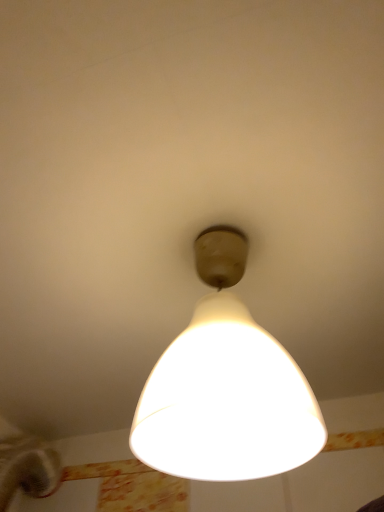
This screenshot has width=384, height=512. What are the coordinates of `matte white lampshade at center` in the screenshot? It's located at (225, 387).

What do you see at coordinates (225, 387) in the screenshot? Image resolution: width=384 pixels, height=512 pixels. I see `matte white lampshade at center` at bounding box center [225, 387].

The width and height of the screenshot is (384, 512). In order to click on matte white lampshade at center in this screenshot , I will do `click(225, 387)`.